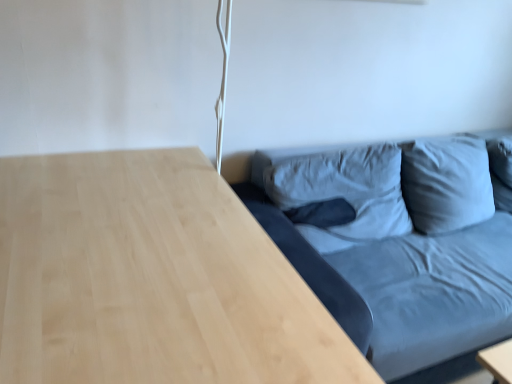
Question: Do you think light wood table at lower right is within matte blue fabric couch at right, or outside of it?

Choices:
 (A) inside
 (B) outside

Answer: (B)

Question: Is light wood table at lower right in front of or behind matte blue fabric couch at right in the image?

Choices:
 (A) front
 (B) behind

Answer: (A)

Question: Visually, is light wood table at lower right positioned to the left or to the right of matte blue fabric couch at right?

Choices:
 (A) right
 (B) left

Answer: (B)

Question: Considering the positions of matte blue fabric couch at right and light wood table at lower right in the image, is matte blue fabric couch at right wider or thinner than light wood table at lower right?

Choices:
 (A) wide
 (B) thin

Answer: (A)

Question: From their relative heights in the image, would you say matte blue fabric couch at right is taller or shorter than light wood table at lower right?

Choices:
 (A) tall
 (B) short

Answer: (A)

Question: Visually, is matte blue fabric couch at right positioned to the left or to the right of light wood table at lower right?

Choices:
 (A) right
 (B) left

Answer: (A)

Question: From a real-world perspective, relative to light wood table at lower right, is matte blue fabric couch at right vertically above or below?

Choices:
 (A) above
 (B) below

Answer: (A)